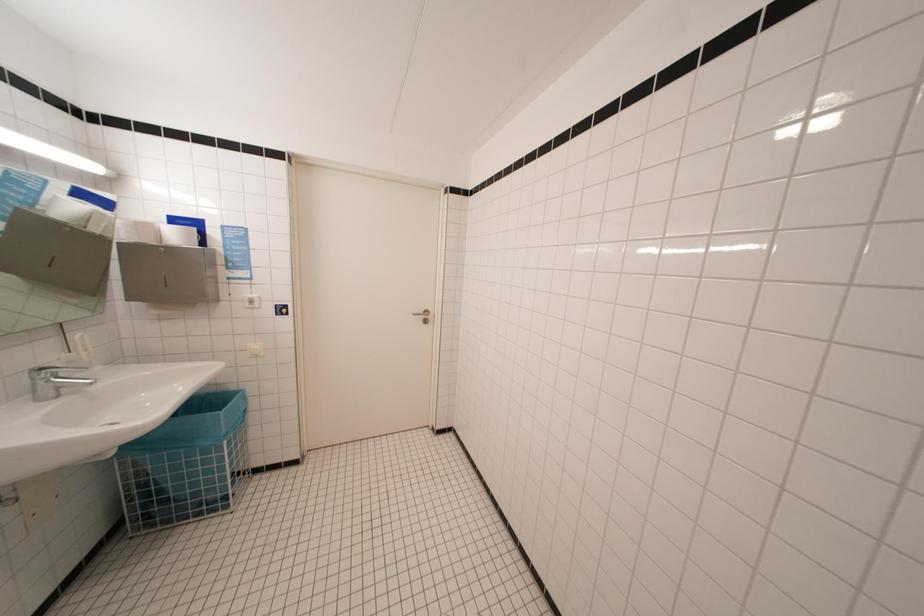
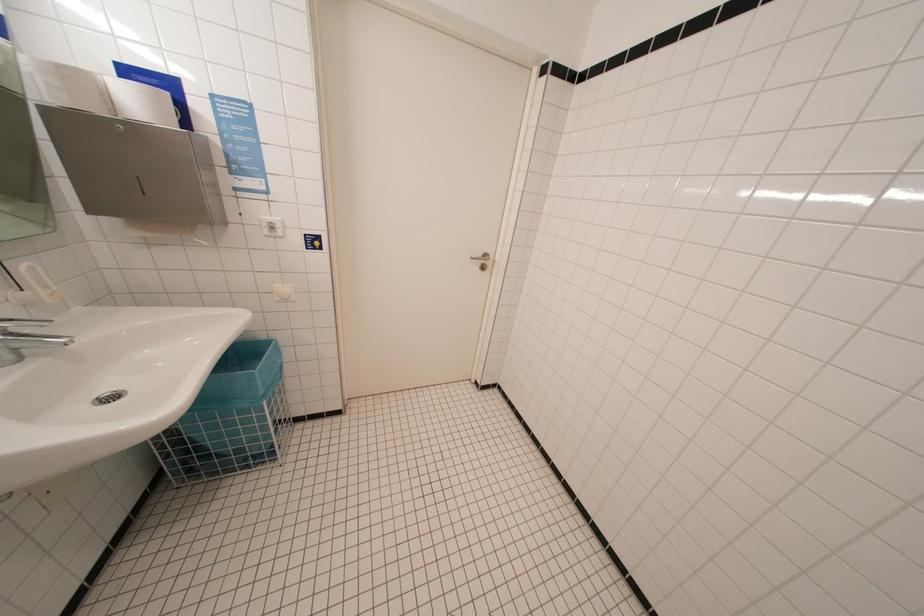
Question: How did the camera likely rotate?

Choices:
 (A) Left
 (B) Right
 (C) Up
 (D) Down

Answer: (D)